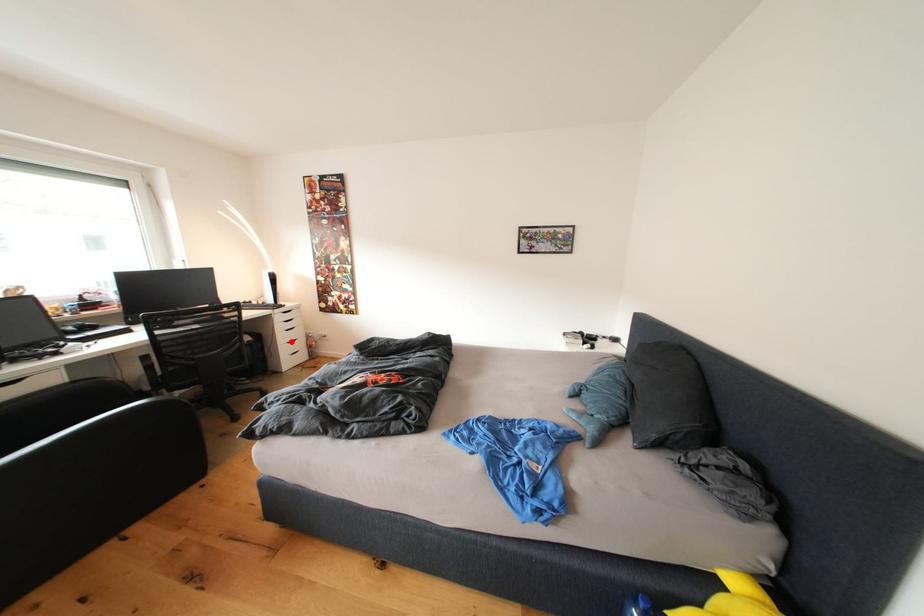
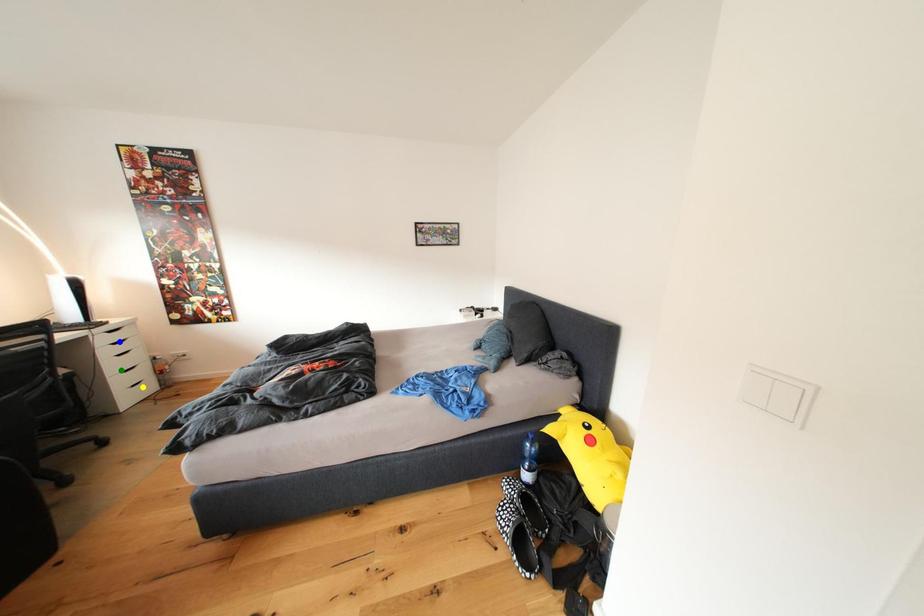
Question: I am providing you with two images of the same scene from different viewpoints. A red point is marked on the first image. You are given multiple points on the second image. Which point in image 2 is actually the same real-world point as the red point in image 1?

Choices:
 (A) green point
 (B) yellow point
 (C) blue point

Answer: (A)